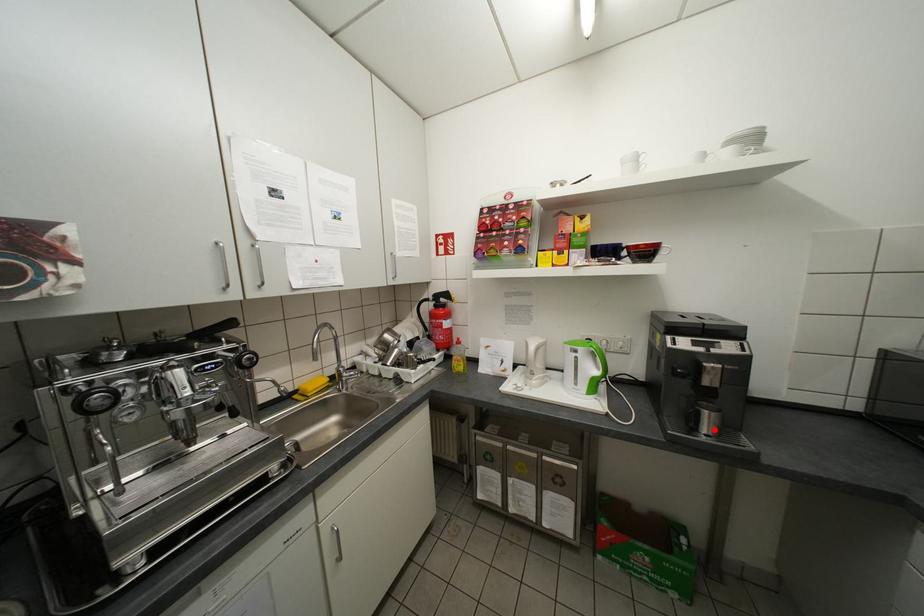
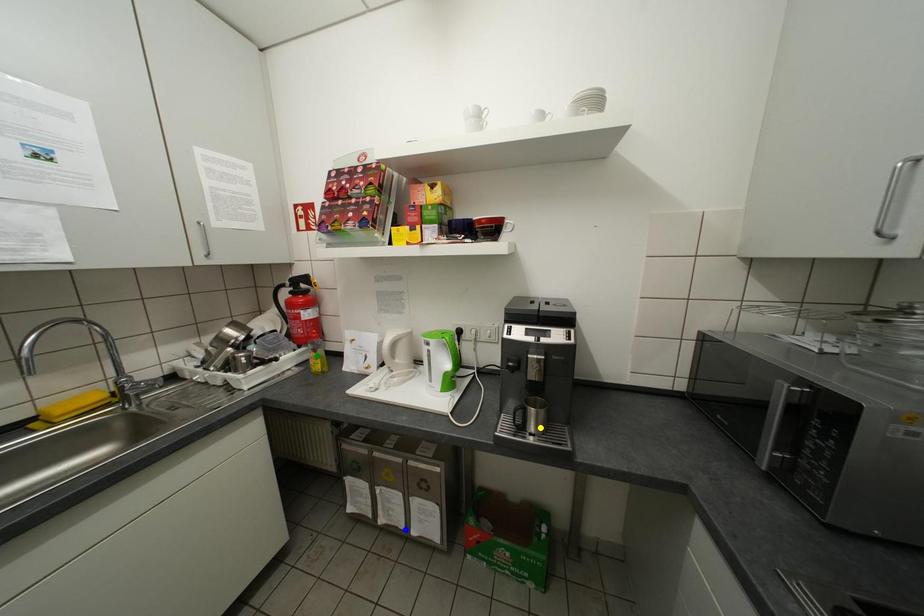
Question: I am providing you with two images of the same scene from different viewpoints. A red point is marked on the first image. You are given multiple points on the second image. Which point in image 2 is actually the same real-world point as the red point in image 1?

Choices:
 (A) green point
 (B) yellow point
 (C) blue point

Answer: (B)